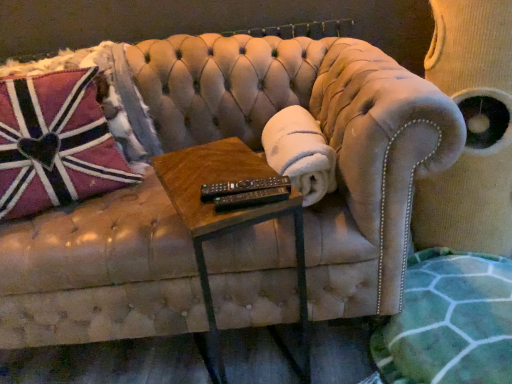
You are a GUI agent. You are given a task and a screenshot of the screen. Output one action in this format:
    pyautogui.click(x=<x>, y=<y>)
    Task: Click on the free space behind black plastic remote at center
    The height and width of the screenshot is (384, 512).
    Given the screenshot: What is the action you would take?
    pyautogui.click(x=227, y=163)